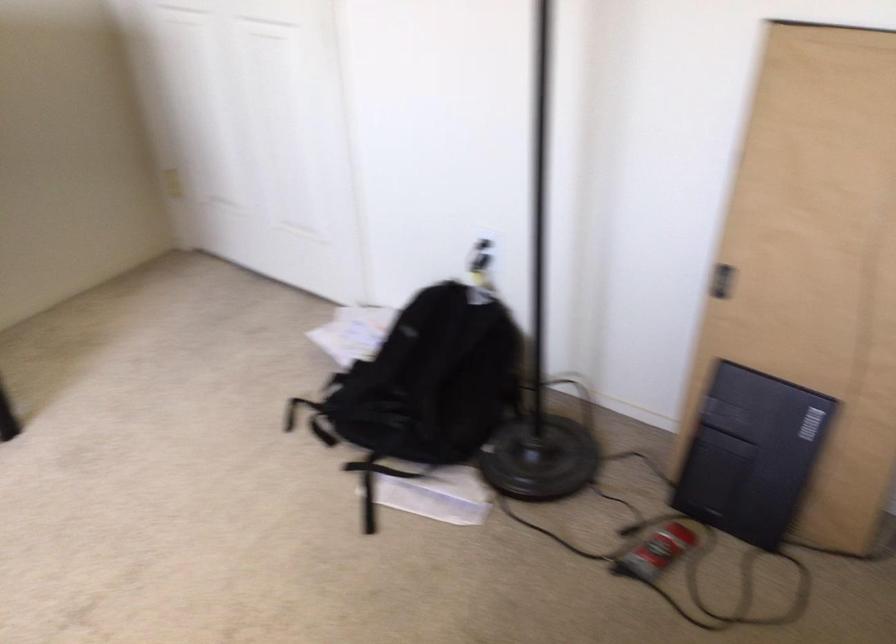
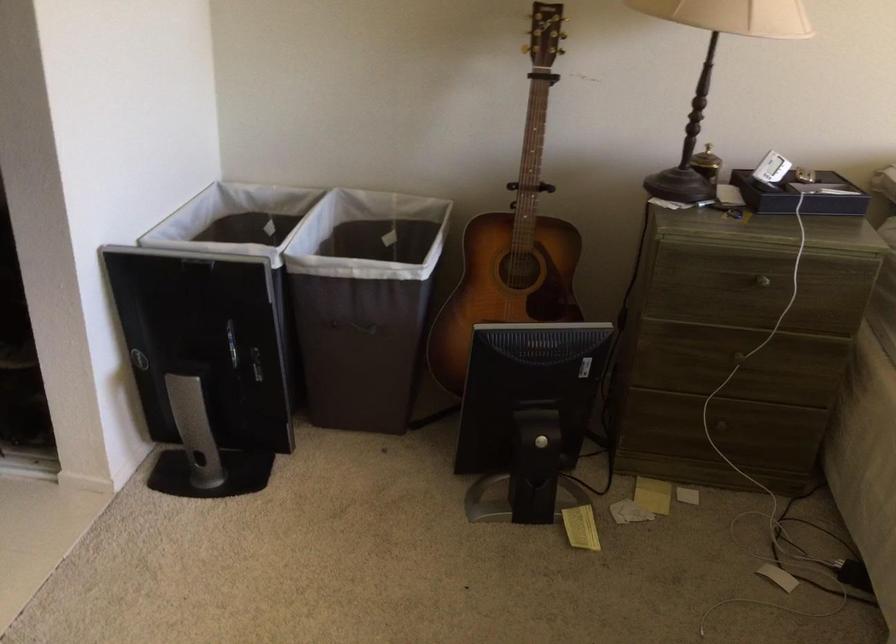
Based on the continuous images, in which direction is the camera rotating?

The camera's rotation is toward right-down.